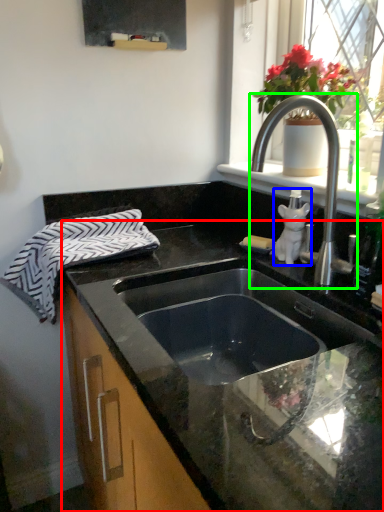
Question: Which is farther away from countertop (highlighted by a red box)? toiletry (highlighted by a blue box) or tap (highlighted by a green box)?

Choices:
 (A) toiletry
 (B) tap

Answer: (A)